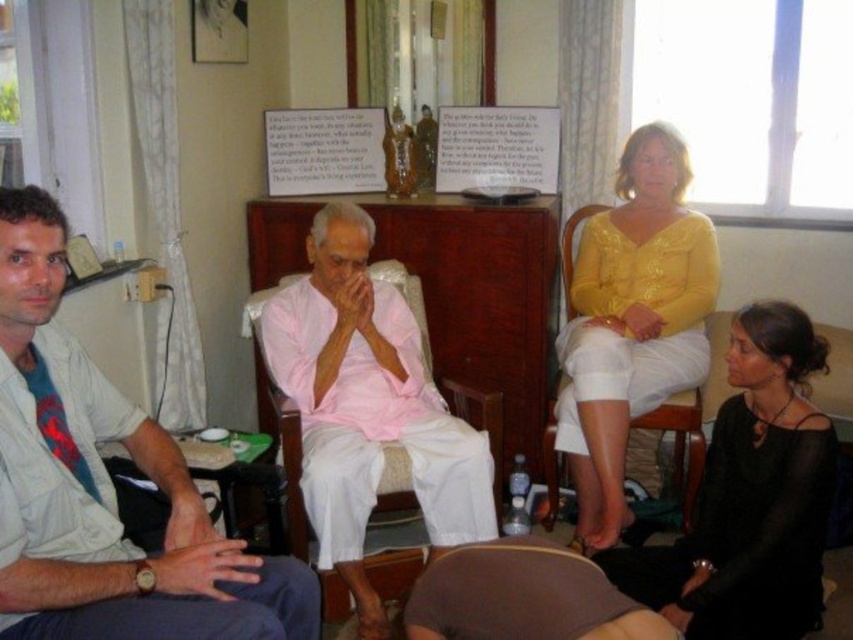
Which of these two, pink cotton cloth at center or brown fabric cushion at lower center, stands taller?

pink cotton cloth at center is taller.

Is pink cotton cloth at center below brown fabric cushion at lower center?

No.

Between point (485, 444) and point (517, 540), which one is positioned behind?

Point (485, 444)

This screenshot has height=640, width=853. In order to click on pink cotton cloth at center in this screenshot , I will do `click(367, 406)`.

Does black sheer dress at lower right have a lesser width compared to yellow shiny blouse at upper right?

In fact, black sheer dress at lower right might be wider than yellow shiny blouse at upper right.

Is point (799, 356) positioned behind point (634, 150)?

No, (799, 356) is closer to viewer.

Locate an element on the screen. This screenshot has width=853, height=640. black sheer dress at lower right is located at coordinates (750, 497).

Between point (45, 246) and point (537, 552), which one is positioned behind?

The point (537, 552) is behind.

Is light beige cotton shirt at center smaller than brown fabric cushion at lower center?

No, light beige cotton shirt at center is not smaller than brown fabric cushion at lower center.

Is point (120, 426) farther from viewer compared to point (538, 596)?

Yes, it is.

Where is `light beige cotton shirt at center`? The height and width of the screenshot is (640, 853). light beige cotton shirt at center is located at coordinates (103, 486).